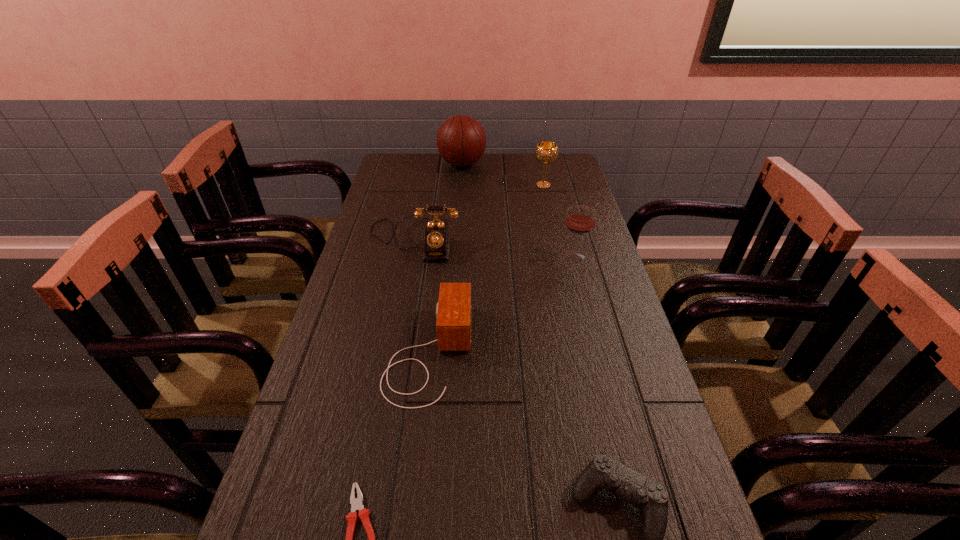
In the image, there is a desktop. At what (x,y) coordinates should I click in order to perform the action: click on vacant space at the left edge. Please return your answer as a coordinate pair (x, y). This screenshot has width=960, height=540. Looking at the image, I should click on (345, 348).

This screenshot has height=540, width=960. In order to click on vacant space at the right edge in this screenshot , I will do `click(605, 516)`.

Where is `vacant space at the far left corner`? This screenshot has height=540, width=960. vacant space at the far left corner is located at coordinates (394, 157).

Find the location of a particular element. vacant space at the far right corner of the desktop is located at coordinates pyautogui.click(x=557, y=160).

Locate an element on the screen. This screenshot has width=960, height=540. vacant area between the wineglass and the chalice is located at coordinates (559, 221).

Identify the location of free space between the wineglass and the farthest object. The width and height of the screenshot is (960, 540). (518, 210).

Where is `vacant space that's between the second farthest object and the basketball`? The width and height of the screenshot is (960, 540). vacant space that's between the second farthest object and the basketball is located at coordinates (503, 174).

I want to click on free space between the telephone and the basketball, so click(x=438, y=202).

Identify the location of object that is the third closest to the wineglass. (546, 152).

At what (x,y) coordinates should I click in order to perform the action: click on the second closest object to the chalice. Please return your answer as a coordinate pair (x, y). Looking at the image, I should click on (436, 238).